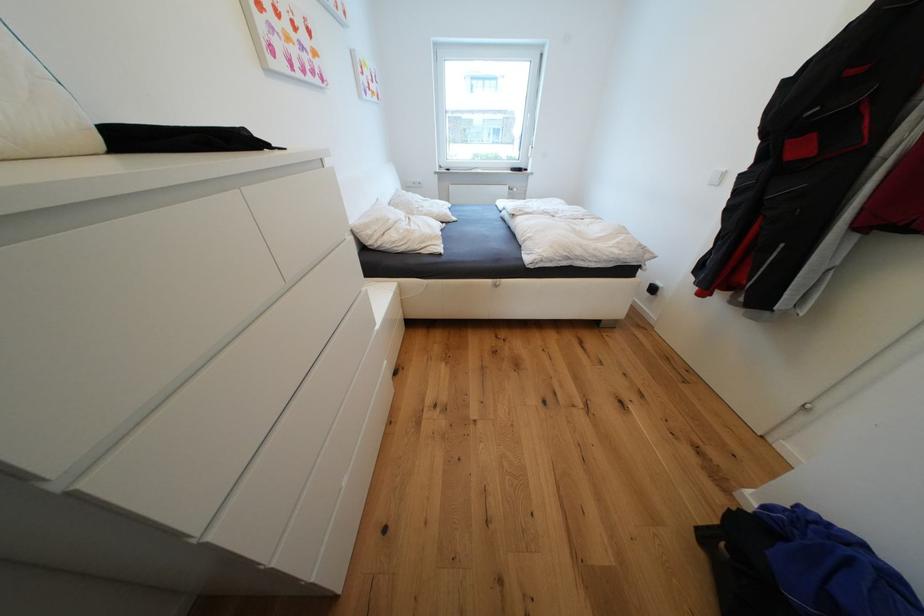
Image resolution: width=924 pixels, height=616 pixels. I want to click on white drawer pull, so click(495, 283).